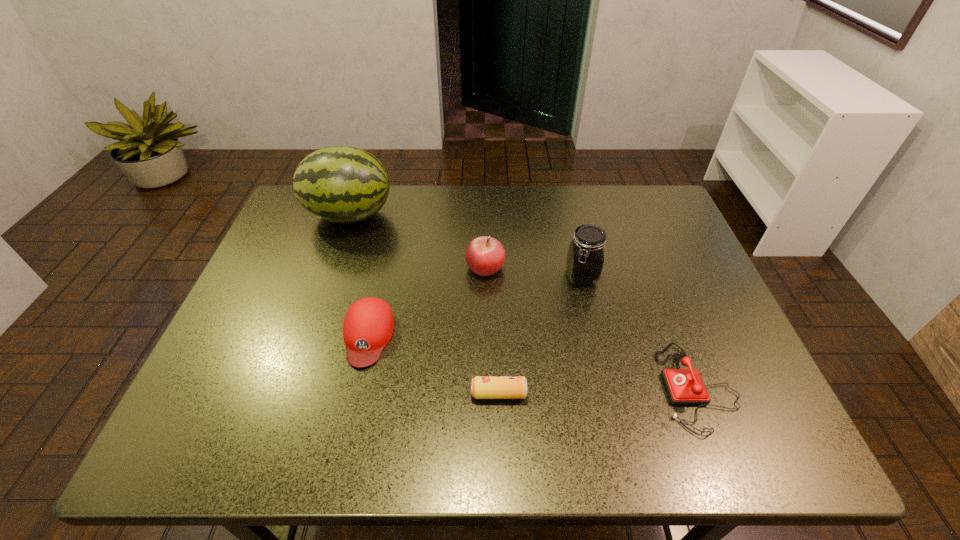
What are the coordinates of `unoccupied position between the apple and the telephone` in the screenshot? It's located at (591, 327).

Identify the location of unoccupied position between the jar and the apple. This screenshot has height=540, width=960. (534, 272).

Image resolution: width=960 pixels, height=540 pixels. In order to click on free space between the beer can and the tallest object in this screenshot , I will do `click(424, 305)`.

This screenshot has width=960, height=540. In order to click on vacant space in between the beer can and the jar in this screenshot , I will do `click(540, 335)`.

The width and height of the screenshot is (960, 540). Find the location of `vacant space in between the jar and the beer can`. vacant space in between the jar and the beer can is located at coordinates (540, 335).

At what (x,y) coordinates should I click in order to perform the action: click on free space between the baseball cap and the tallest object. Please return your answer as a coordinate pair (x, y). Image resolution: width=960 pixels, height=540 pixels. Looking at the image, I should click on click(359, 275).

The image size is (960, 540). Identify the location of free space that is in between the beer can and the third shortest object. (433, 364).

Image resolution: width=960 pixels, height=540 pixels. Identify the location of vacant space in between the shortest object and the baseball cap. (433, 364).

Where is `vacant area that lies between the watermelon and the shortest object`? vacant area that lies between the watermelon and the shortest object is located at coordinates (424, 305).

This screenshot has width=960, height=540. In order to click on object that is the nearest to the beer can in this screenshot , I will do `click(368, 326)`.